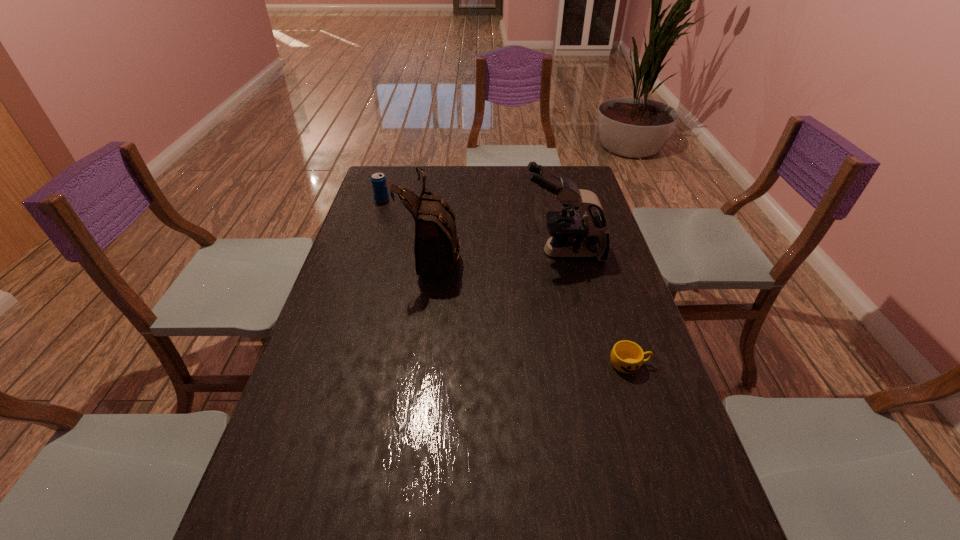
Find the location of `free area in between the shoulder bag and the farthest object`. free area in between the shoulder bag and the farthest object is located at coordinates (408, 227).

Where is `blank region between the shoulder bag and the farthest object`? The height and width of the screenshot is (540, 960). blank region between the shoulder bag and the farthest object is located at coordinates (408, 227).

At what (x,y) coordinates should I click in order to perform the action: click on free space between the microscope and the cup. Please return your answer as a coordinate pair (x, y). The height and width of the screenshot is (540, 960). Looking at the image, I should click on (596, 308).

Locate an element on the screen. This screenshot has width=960, height=540. free point between the nearest object and the second object from left to right is located at coordinates (532, 309).

The height and width of the screenshot is (540, 960). I want to click on vacant area that lies between the shoulder bag and the farthest object, so click(x=408, y=227).

I want to click on free space between the microscope and the leftmost object, so click(472, 226).

Identify which object is the closest to the second object from left to right. Please provide its 2D coordinates. Your answer should be formatted as a tuple, i.e. [(x, y)], where the tuple contains the x and y coordinates of a point satisfying the conditions above.

[(571, 235)]

Point out which object is positioned as the nearest to the shoulder bag. Please provide its 2D coordinates. Your answer should be formatted as a tuple, i.e. [(x, y)], where the tuple contains the x and y coordinates of a point satisfying the conditions above.

[(571, 235)]

Image resolution: width=960 pixels, height=540 pixels. In order to click on free space that satisfies the following two spatial constraints: 1. on the back side of the nearest object; 2. on the front-facing side of the shoulder bag in this screenshot , I will do `click(595, 255)`.

I want to click on vacant region that satisfies the following two spatial constraints: 1. on the front-facing side of the third object from right to left; 2. on the right side of the shortest object, so click(420, 363).